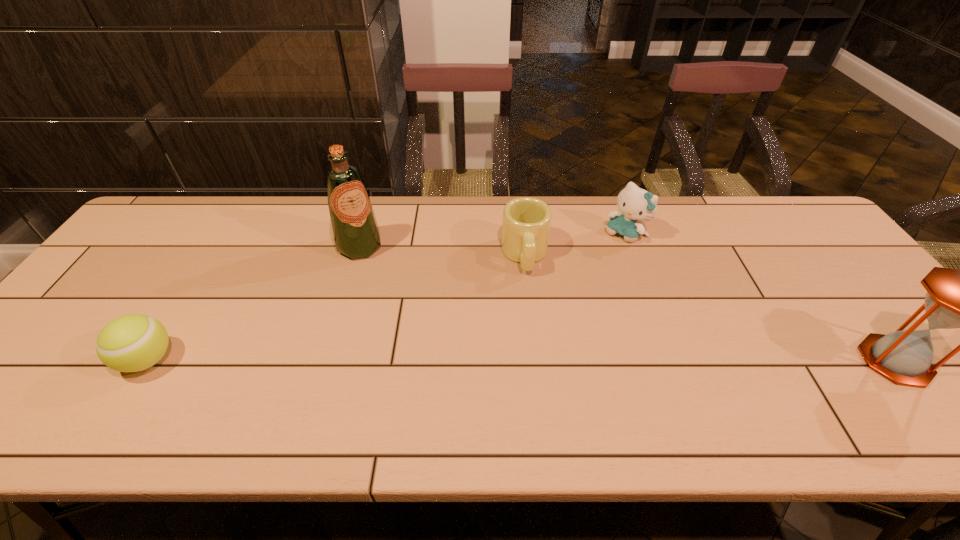
This screenshot has height=540, width=960. In order to click on free spot on the desktop that is between the tennis ball and the rightmost object and is positioned on the front-facing side of the olive oil in this screenshot , I will do `click(444, 360)`.

Find the location of a particular element. The height and width of the screenshot is (540, 960). free spot on the desktop that is between the leftmost object and the hourglass and is positioned on the face of the kitten is located at coordinates (493, 360).

This screenshot has height=540, width=960. In order to click on vacant spot on the desktop that is between the tennis ball and the second tallest object and is positioned with the handle on the side of the mug in this screenshot , I will do `click(535, 360)`.